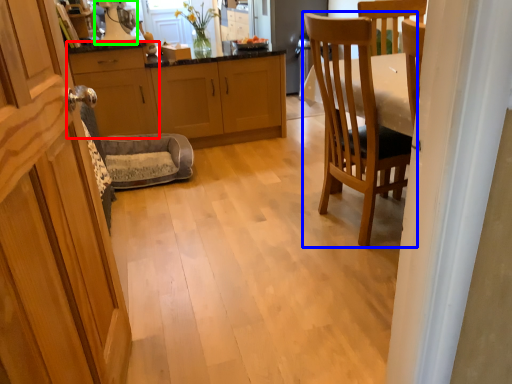
Question: Estimate the real-world distances between objects in this image. Which object is farther from cabinetry (highlighted by a red box), chair (highlighted by a blue box) or appliance (highlighted by a green box)?

Choices:
 (A) chair
 (B) appliance

Answer: (A)